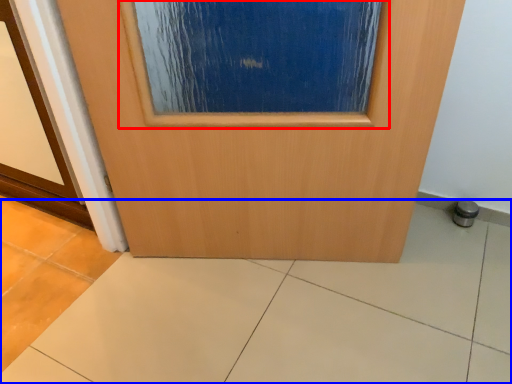
Question: Which object appears closest to the camera in this image, airplane window (highlighted by a red box) or ceramic tile (highlighted by a blue box)?

Choices:
 (A) airplane window
 (B) ceramic tile

Answer: (B)